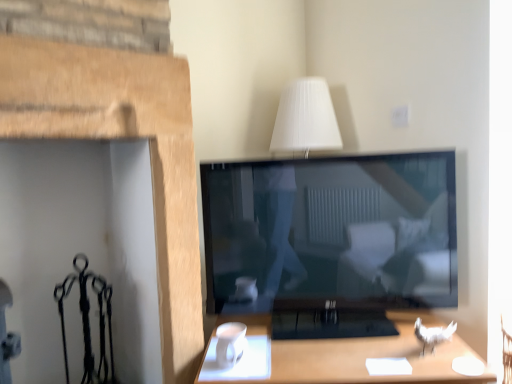
The height and width of the screenshot is (384, 512). Find the location of `free space above wooden desk at lower right (from a real-world perspective)`. free space above wooden desk at lower right (from a real-world perspective) is located at coordinates (315, 345).